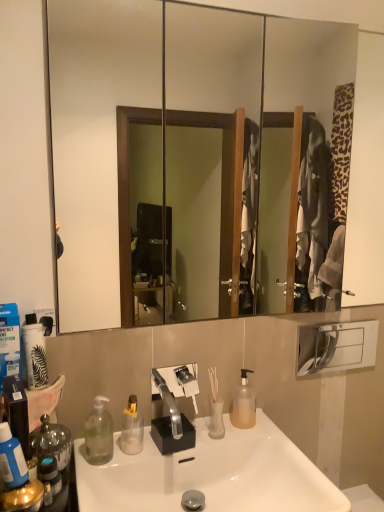
Locate an element on the screen. free point below clear glass mirror at upper center (from a real-world perspective) is located at coordinates (215, 321).